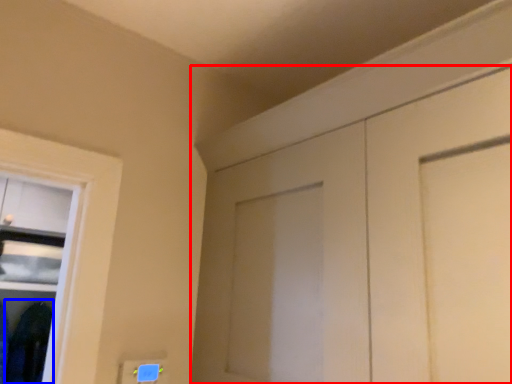
Question: Which object is further to the camera taking this photo, door (highlighted by a red box) or clothing (highlighted by a blue box)?

Choices:
 (A) door
 (B) clothing

Answer: (B)